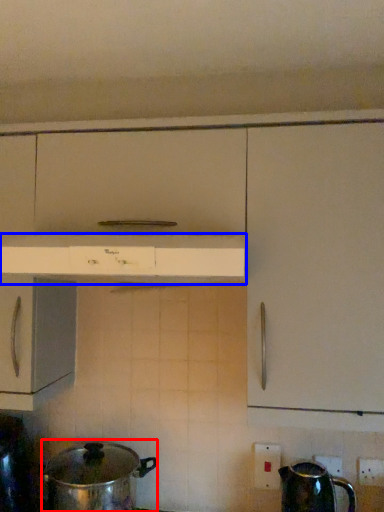
Question: Among these objects, which one is nearest to the camera, crock pot (highlighted by a red box) or home appliance (highlighted by a blue box)?

Choices:
 (A) crock pot
 (B) home appliance

Answer: (B)